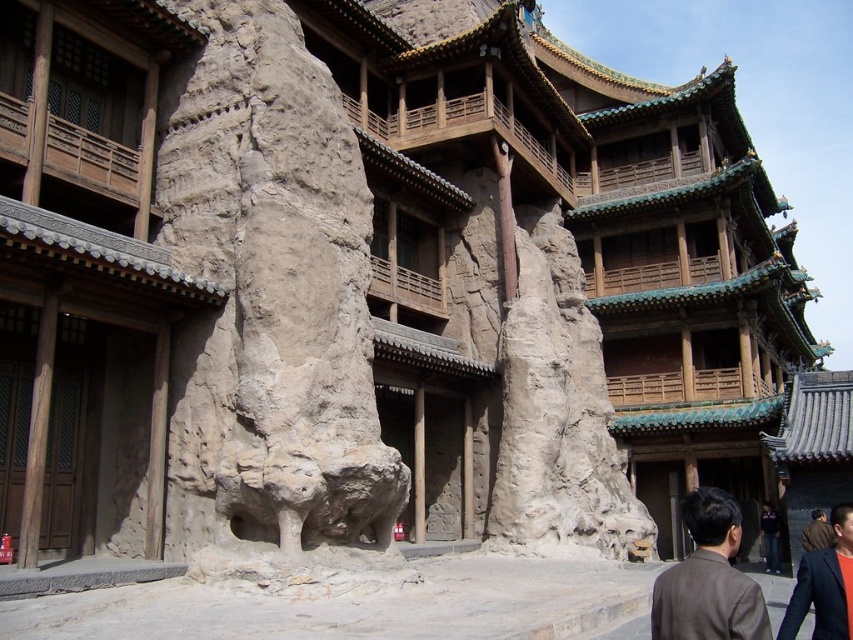
You are standing in front of the traditional East Asian architectural structure and notice a brown woolen coat at lower right and dark blue jeans at lower right. Which item is wider?

The brown woolen coat at lower right is wider than the dark blue jeans at lower right according to the description.

What is located at the point with coordinates (271, 296) in the image?

→ The point at coordinates (271, 296) marks the location of the natural stone lion at center.